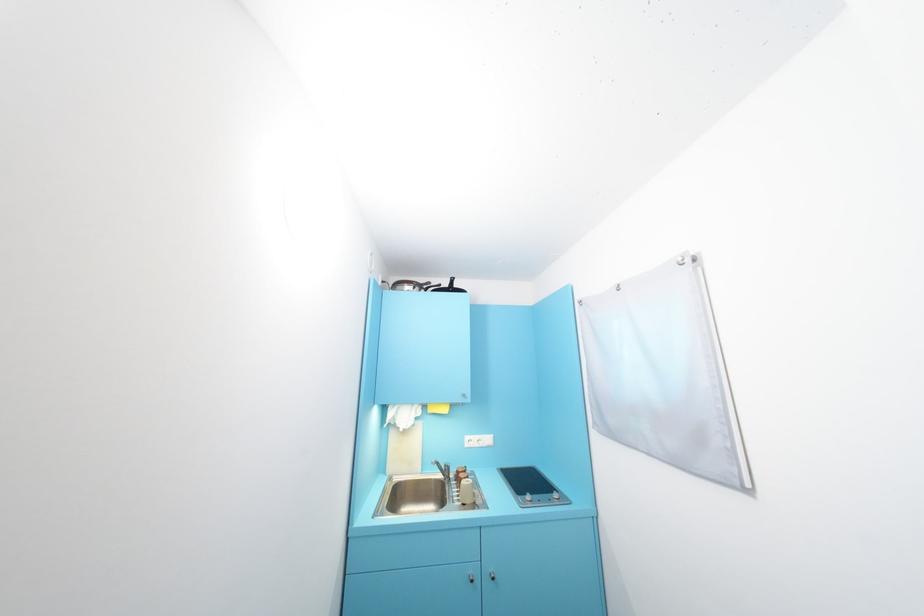
I want to click on white cutting board, so click(x=663, y=371).